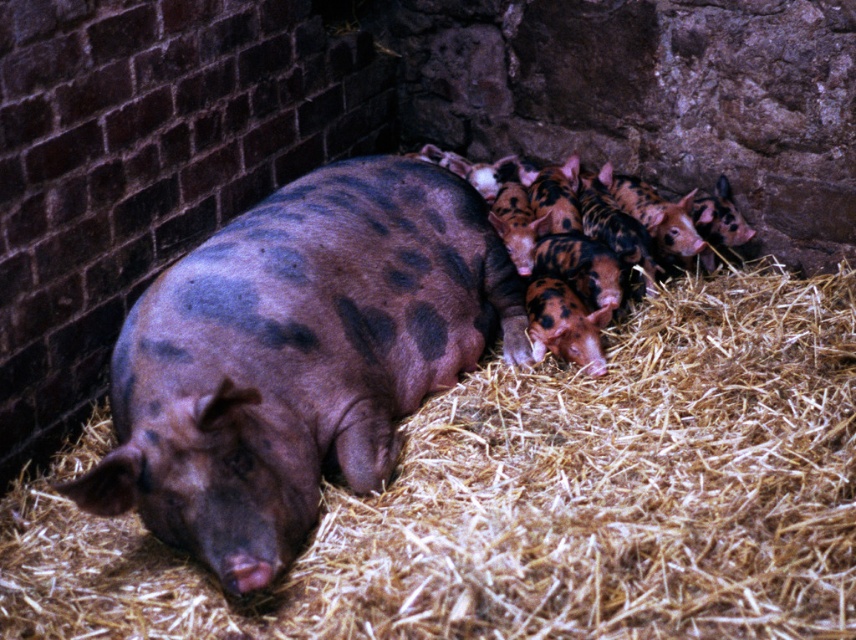
You are standing in the barn and want to place a small toy between the two points, point (x=389, y=609) and point (x=155, y=424). Which point should the toy be closer to if you want it to appear larger in your view?

The toy should be placed closer to point (x=389, y=609) because it is closer to the camera, making objects placed there appear larger in your view.

You are a farmer checking the barn. You notice the brown straw at center and the speckled brown pig at center. Which one is taller?

The speckled brown pig at center is taller than the brown straw at center.